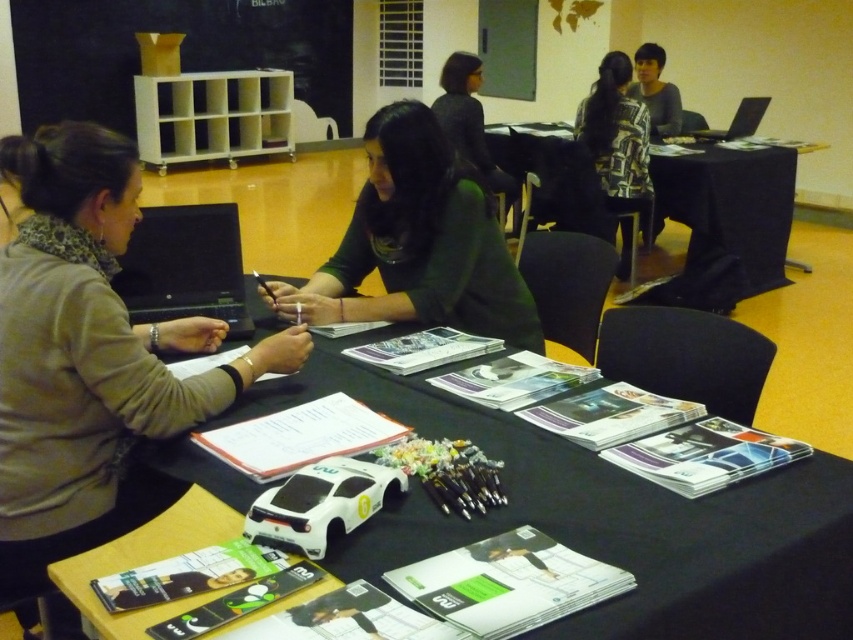
Question: Is green matte shirt at center wider than black matte laptop at center?

Choices:
 (A) no
 (B) yes

Answer: (B)

Question: Does patterned fabric shirt at upper center appear over dark gray sweater at center?

Choices:
 (A) no
 (B) yes

Answer: (A)

Question: Is green matte shirt at center positioned before black plastic laptop at upper right?

Choices:
 (A) yes
 (B) no

Answer: (A)

Question: Which point is farther from the camera taking this photo?

Choices:
 (A) (223, 305)
 (B) (422, 308)
 (C) (448, 97)
 (D) (749, 128)

Answer: (D)

Question: Which point is closer to the camera?

Choices:
 (A) (469, 138)
 (B) (148, 312)

Answer: (B)

Question: Which point appears farthest from the camera in this image?

Choices:
 (A) (751, 104)
 (B) (633, 620)
 (C) (724, 230)
 (D) (492, 170)

Answer: (D)